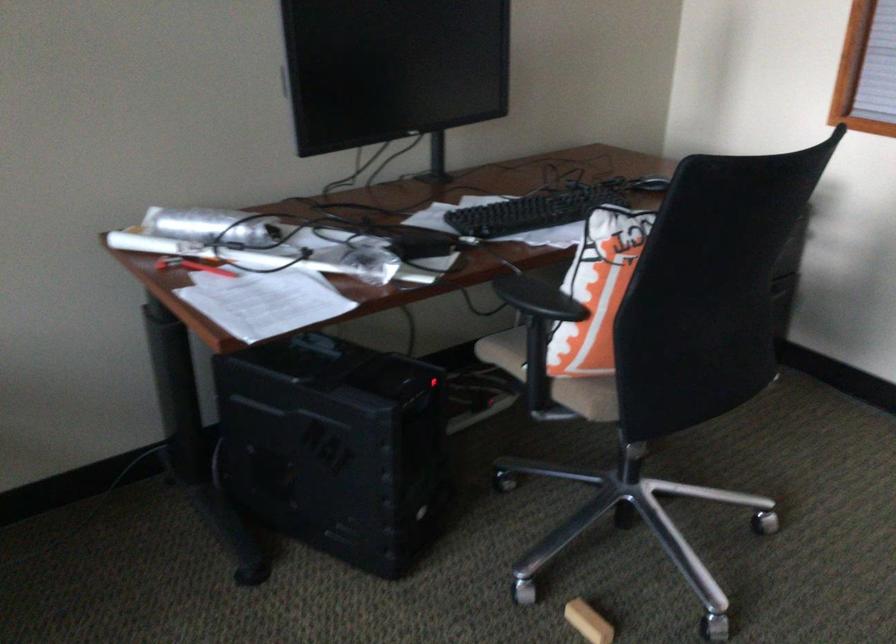
The width and height of the screenshot is (896, 644). In order to click on black chair armrest in this screenshot , I will do `click(538, 299)`.